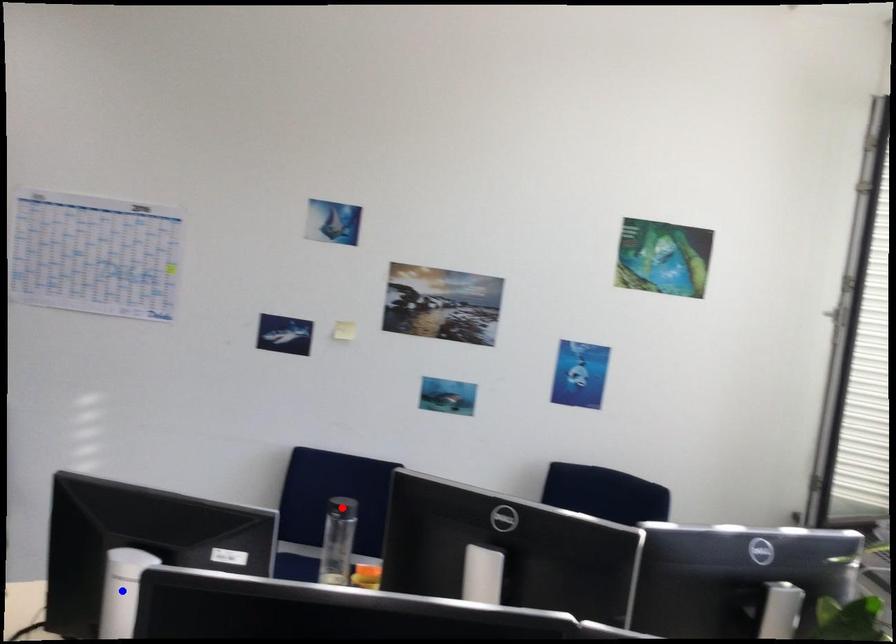
Question: In the image, two points are highlighted. Which point is nearer to the camera? Reply with the corresponding letter.

Choices:
 (A) blue point
 (B) red point

Answer: (A)